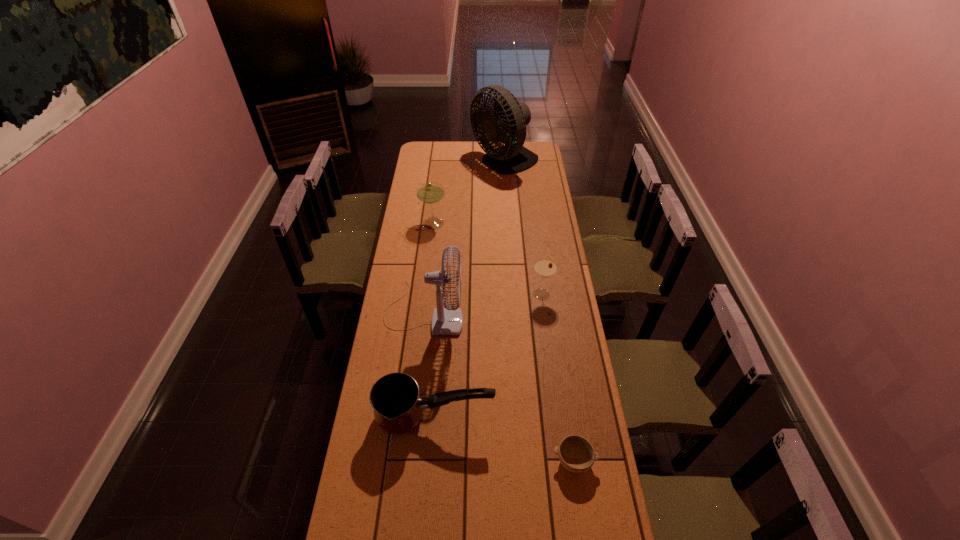
I want to click on the farthest object, so click(x=507, y=122).

At what (x,y) coordinates should I click in order to perform the action: click on the right fan. Please return your answer as a coordinate pair (x, y). The image size is (960, 540). Looking at the image, I should click on (507, 122).

The height and width of the screenshot is (540, 960). I want to click on the left fan, so click(x=445, y=321).

What are the coordinates of `the shorter fan` in the screenshot? It's located at (445, 321).

The width and height of the screenshot is (960, 540). What are the coordinates of `the left martini` in the screenshot? It's located at (429, 192).

Where is `the third tallest object`? The width and height of the screenshot is (960, 540). the third tallest object is located at coordinates (429, 192).

You are a GUI agent. You are given a task and a screenshot of the screen. Output one action in this format:
    pyautogui.click(x=<x>, y=<y>)
    Task: Click on the right martini
    This screenshot has width=960, height=540.
    Given the screenshot: What is the action you would take?
    pyautogui.click(x=544, y=267)

You are a GUI agent. You are given a task and a screenshot of the screen. Output one action in this format:
    pyautogui.click(x=<x>, y=<y>)
    Task: Click on the nearer martini
    This screenshot has height=540, width=960.
    Given the screenshot: What is the action you would take?
    pyautogui.click(x=544, y=267)

This screenshot has width=960, height=540. What are the coordinates of `saucepan` in the screenshot? It's located at (395, 398).

Locate an element on the screen. Image resolution: width=960 pixels, height=540 pixels. the shortest object is located at coordinates point(576,454).